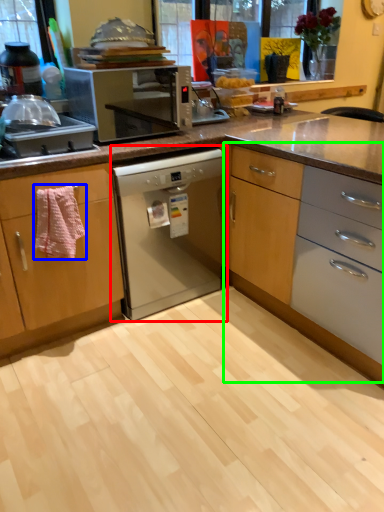
Question: Which object is positioned closest to home appliance (highlighted by a red box)? Select from cloth (highlighted by a blue box) and cabinetry (highlighted by a green box).

Choices:
 (A) cloth
 (B) cabinetry

Answer: (B)